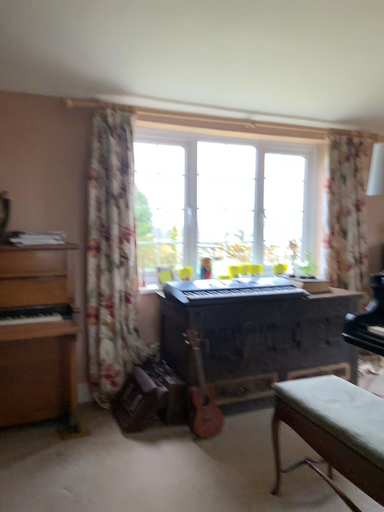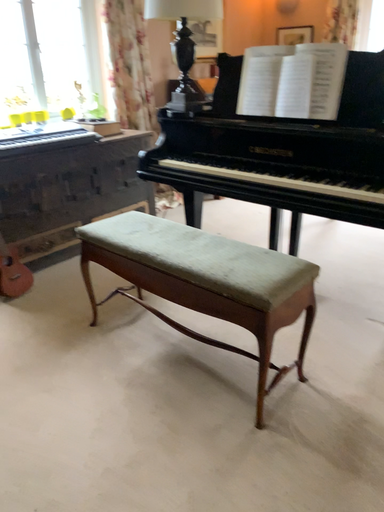
Question: How did the camera likely rotate when shooting the video?

Choices:
 (A) rotated left
 (B) rotated right

Answer: (B)